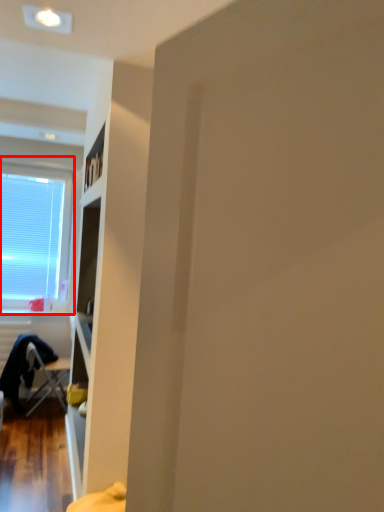
Question: From the image's perspective, considering the relative positions of window (annotated by the red box) and chair in the image provided, where is window (annotated by the red box) located with respect to the staircase?

Choices:
 (A) above
 (B) below

Answer: (A)